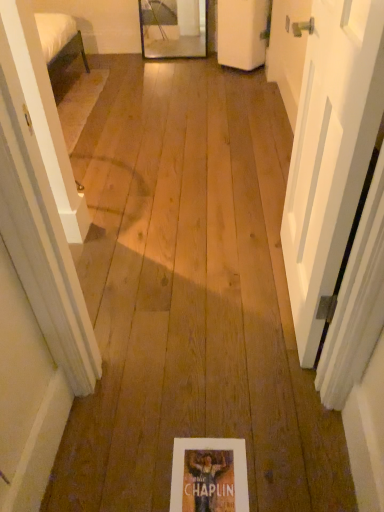
Question: Considering the relative sizes of white matte door at right, which appears as the first door when viewed from the front, and matte paper flyer at center in the image provided, is white matte door at right, which appears as the first door when viewed from the front, smaller than matte paper flyer at center?

Choices:
 (A) no
 (B) yes

Answer: (A)

Question: Considering the relative positions of white matte door at right, which appears as the 1th door when ordered from the bottom, and matte paper flyer at center in the image provided, is white matte door at right, which appears as the 1th door when ordered from the bottom, to the left of matte paper flyer at center from the viewer's perspective?

Choices:
 (A) no
 (B) yes

Answer: (A)

Question: From the image's perspective, is white matte door at right, which appears as the first door when viewed from the front, located above matte paper flyer at center?

Choices:
 (A) no
 (B) yes

Answer: (B)

Question: From a real-world perspective, is white matte door at right, acting as the second door starting from the back, located higher than matte paper flyer at center?

Choices:
 (A) yes
 (B) no

Answer: (A)

Question: Considering the relative sizes of white matte door at right, which appears as the 1th door when ordered from the bottom, and matte paper flyer at center in the image provided, is white matte door at right, which appears as the 1th door when ordered from the bottom, wider than matte paper flyer at center?

Choices:
 (A) yes
 (B) no

Answer: (B)

Question: Is point (317, 28) positioned closer to the camera than point (249, 58)?

Choices:
 (A) farther
 (B) closer

Answer: (B)

Question: From a real-world perspective, relative to white matte door at upper center, the second door ordered from the bottom, is white matte door at right, which appears as the first door when viewed from the front, vertically above or below?

Choices:
 (A) above
 (B) below

Answer: (A)

Question: In terms of height, does white matte door at right, which appears as the first door when viewed from the front, look taller or shorter compared to white matte door at upper center, which is counted as the 1th door, starting from the back?

Choices:
 (A) tall
 (B) short

Answer: (A)

Question: Is white matte door at right, acting as the second door starting from the back, situated inside white matte door at upper center, acting as the 1th door starting from the top, or outside?

Choices:
 (A) inside
 (B) outside

Answer: (B)

Question: Is matte paper flyer at center to the left or to the right of white matte door at right, which appears as the first door when viewed from the front, in the image?

Choices:
 (A) left
 (B) right

Answer: (A)

Question: In terms of height, does matte paper flyer at center look taller or shorter compared to white matte door at right, which appears as the first door when viewed from the front?

Choices:
 (A) tall
 (B) short

Answer: (B)

Question: Based on their sizes in the image, would you say matte paper flyer at center is bigger or smaller than white matte door at right, placed as the second door when sorted from top to bottom?

Choices:
 (A) big
 (B) small

Answer: (B)

Question: Is point (241, 451) closer or farther from the camera than point (344, 4)?

Choices:
 (A) farther
 (B) closer

Answer: (A)

Question: Relative to matte paper flyer at center, is white matte door at right, which appears as the first door when viewed from the front, in front or behind?

Choices:
 (A) behind
 (B) front

Answer: (B)

Question: From the image's perspective, is white matte door at right, acting as the second door starting from the back, located above or below matte paper flyer at center?

Choices:
 (A) below
 (B) above

Answer: (B)